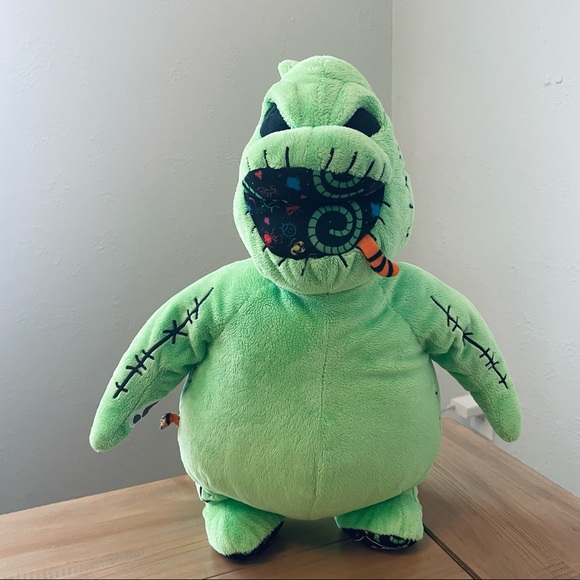
Find the location of a particular element. The image size is (580, 580). electrical outlet is located at coordinates [473, 420].